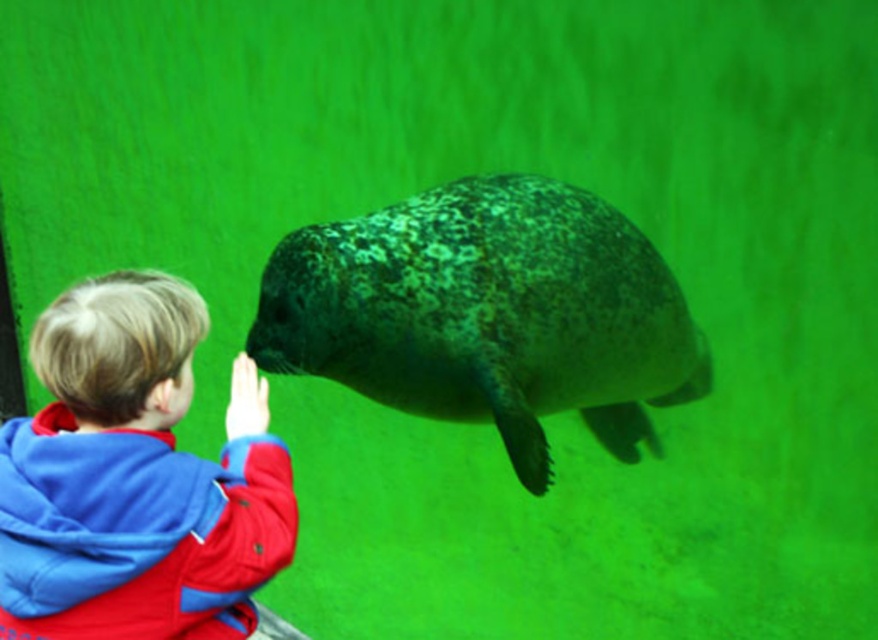
Question: From the image, what is the correct spatial relationship of speckled dark green seal at center in relation to blue fleece jacket at lower left?

Choices:
 (A) above
 (B) below

Answer: (A)

Question: Which point is farther to the camera?

Choices:
 (A) (326, 376)
 (B) (90, 632)

Answer: (A)

Question: Does speckled dark green seal at center appear on the left side of blue fleece jacket at lower left?

Choices:
 (A) no
 (B) yes

Answer: (A)

Question: Which object appears closest to the camera in this image?

Choices:
 (A) speckled dark green seal at center
 (B) blue fleece jacket at lower left

Answer: (B)

Question: From the image, what is the correct spatial relationship of speckled dark green seal at center in relation to blue fleece jacket at lower left?

Choices:
 (A) right
 (B) left

Answer: (A)